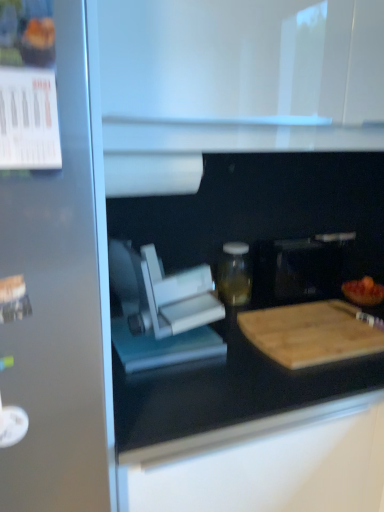
Where is `free space above wooden cutting board at lower right (from a real-world perspective)`? Image resolution: width=384 pixels, height=512 pixels. free space above wooden cutting board at lower right (from a real-world perspective) is located at coordinates (314, 327).